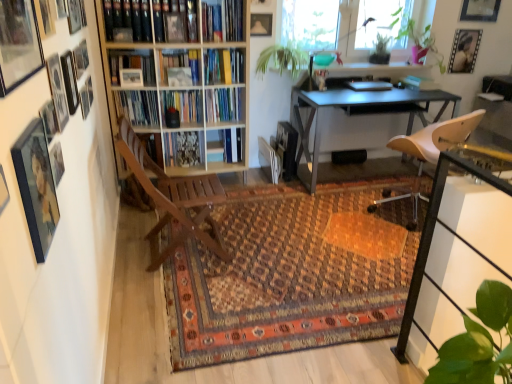
Locate an element on the screen. The width and height of the screenshot is (512, 384). free space underneath brown wooden chair at center, which is the second chair from right to left (from a real-world perspective) is located at coordinates (186, 245).